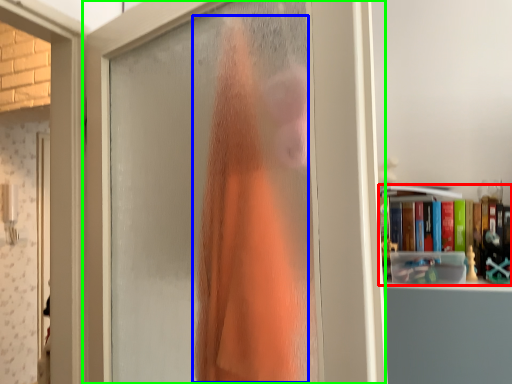
Question: Estimate the real-world distances between objects in this image. Which object is farther from book (highlighted by a red box), clothing (highlighted by a blue box) or door (highlighted by a green box)?

Choices:
 (A) clothing
 (B) door

Answer: (B)